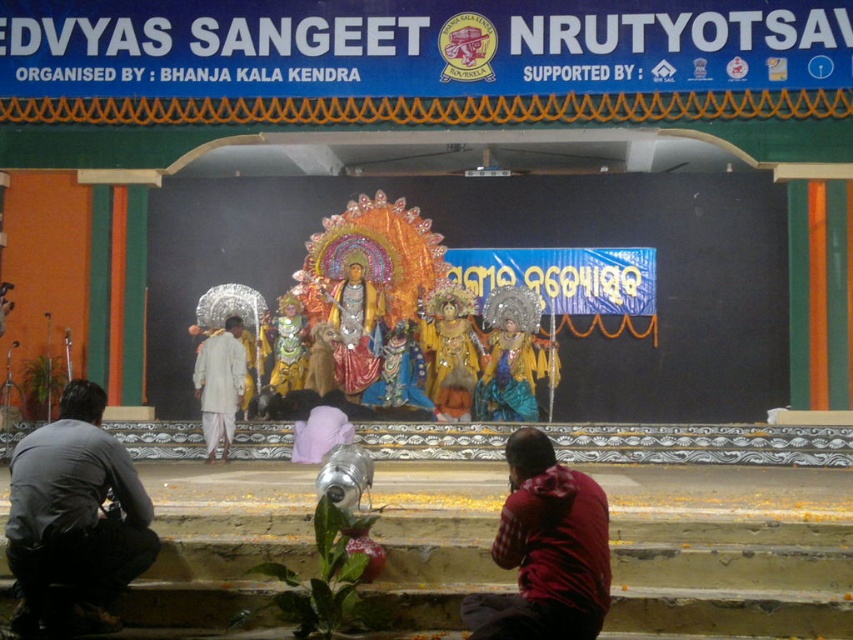
Who is more distant from viewer, (115, 470) or (369, 381)?

The point (369, 381) is behind.

Who is lower down, dark gray fabric at lower left or gold metallic statue at center?

dark gray fabric at lower left

Locate an element on the screen. The image size is (853, 640). dark gray fabric at lower left is located at coordinates (74, 515).

Does gold metallic statue at center have a greater height compared to white cotton kurta at center?

Yes, gold metallic statue at center is taller than white cotton kurta at center.

Who is positioned more to the right, gold metallic statue at center or white cotton kurta at center?

gold metallic statue at center is more to the right.

Between point (364, 301) and point (225, 372), which one is positioned in front?

Point (225, 372) is in front.

Where is `gold metallic statue at center`? gold metallic statue at center is located at coordinates (354, 330).

Measure the distance between point (471, 314) and camera.

Point (471, 314) is 215.93 feet from camera.

Does gold metallic costume at center have a smaller size compared to gold metallic statue at center?

No, gold metallic costume at center is not smaller than gold metallic statue at center.

The width and height of the screenshot is (853, 640). What are the coordinates of `gold metallic costume at center` in the screenshot? It's located at (450, 349).